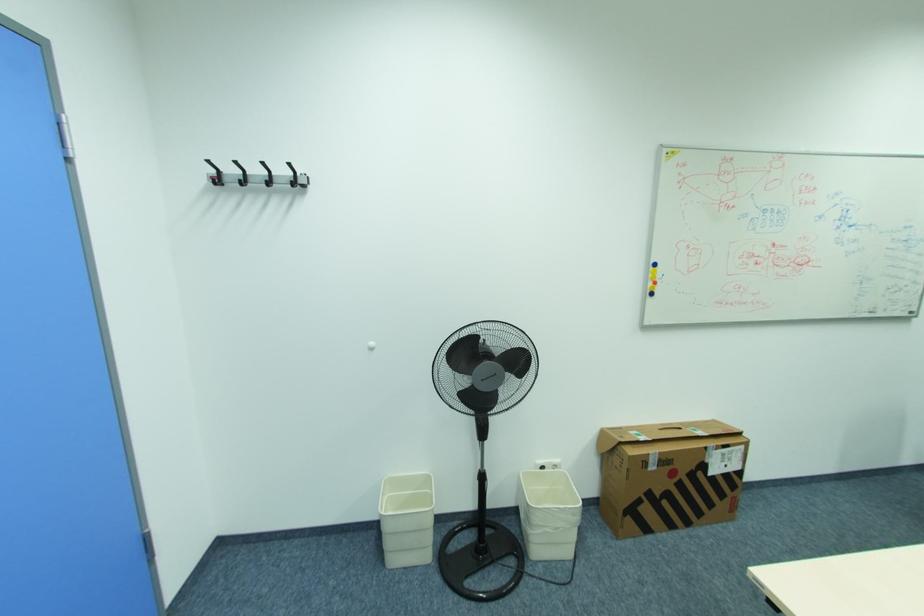
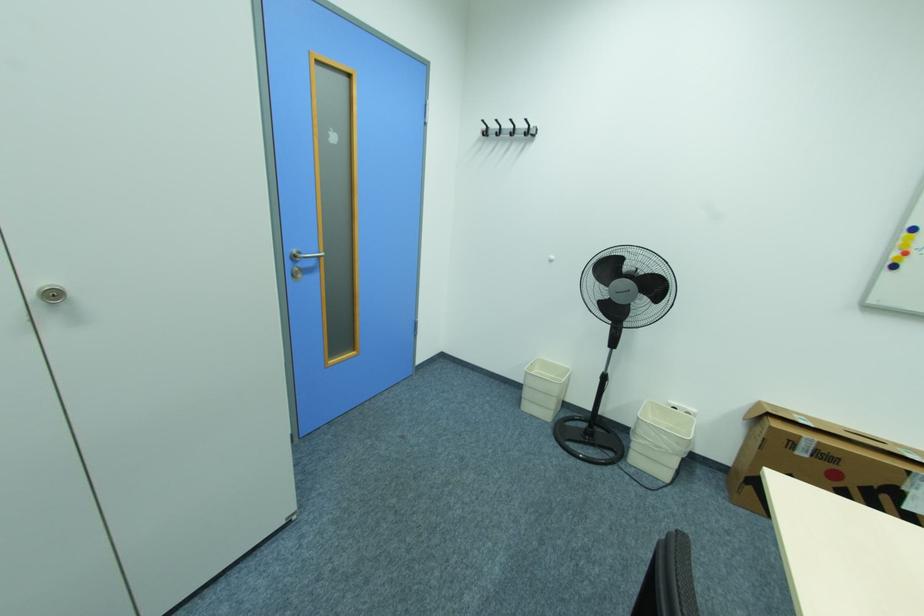
The point at (x=394, y=543) is marked in the first image. Where is the corresponding point in the second image?

(531, 394)